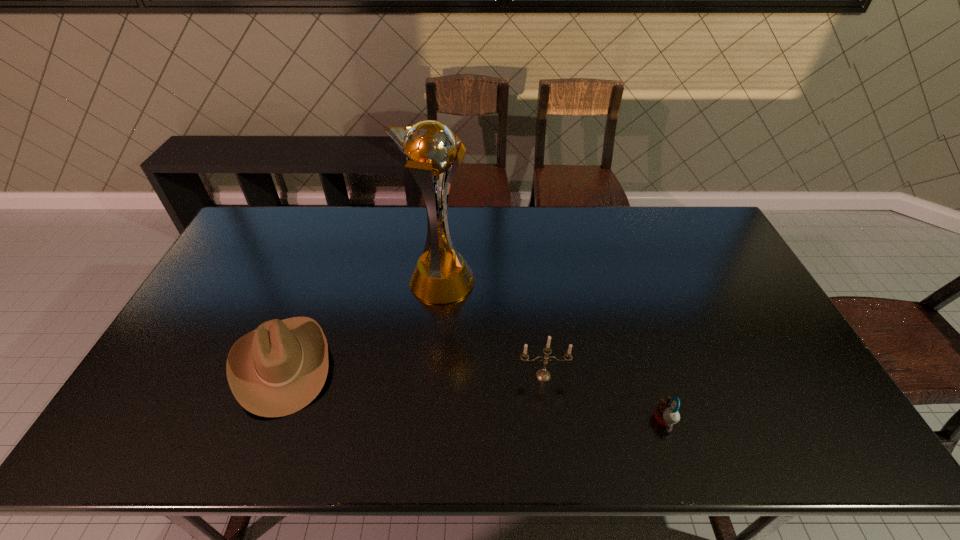
You are a GUI agent. You are given a task and a screenshot of the screen. Output one action in this format:
    pyautogui.click(x=<x>, y=<y>)
    Task: Click on the farthest object
    This screenshot has width=960, height=540.
    Given the screenshot: What is the action you would take?
    pyautogui.click(x=441, y=275)

Find the location of a particular element. Image resolution: width=960 pixels, height=540 pixels. trophy is located at coordinates (441, 275).

The image size is (960, 540). I want to click on the third object from left to right, so click(543, 375).

This screenshot has height=540, width=960. What are the coordinates of `candle` in the screenshot? It's located at (543, 375).

At what (x,y) coordinates should I click in order to perform the action: click on the leftmost object. Please return your answer as a coordinate pair (x, y). The height and width of the screenshot is (540, 960). Looking at the image, I should click on (277, 369).

Where is `the third tallest object`? Image resolution: width=960 pixels, height=540 pixels. the third tallest object is located at coordinates (277, 369).

Where is `the shortest object`? This screenshot has height=540, width=960. the shortest object is located at coordinates (666, 414).

You are a GUI agent. You are given a task and a screenshot of the screen. Output one action in this format:
    pyautogui.click(x=<x>, y=<y>)
    Task: Click on the rightmost object
    Image resolution: width=960 pixels, height=540 pixels.
    Given the screenshot: What is the action you would take?
    pyautogui.click(x=666, y=414)

Where is `free region located on the front-facing side of the farthest object`? The height and width of the screenshot is (540, 960). free region located on the front-facing side of the farthest object is located at coordinates (515, 282).

Where is `vacant space located on the left of the third shortest object`? This screenshot has width=960, height=540. vacant space located on the left of the third shortest object is located at coordinates (476, 375).